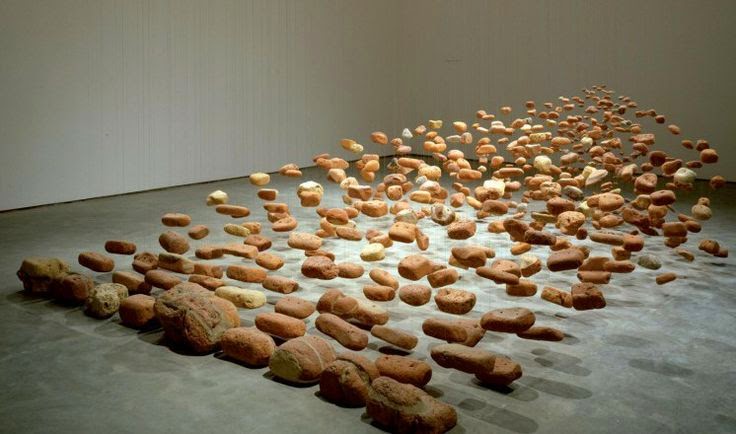
Image resolution: width=736 pixels, height=434 pixels. Identify the location of left wall background. (196, 82).